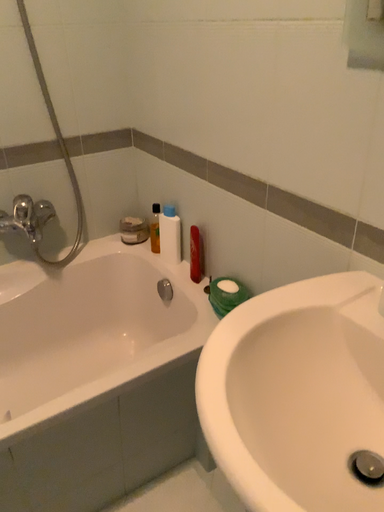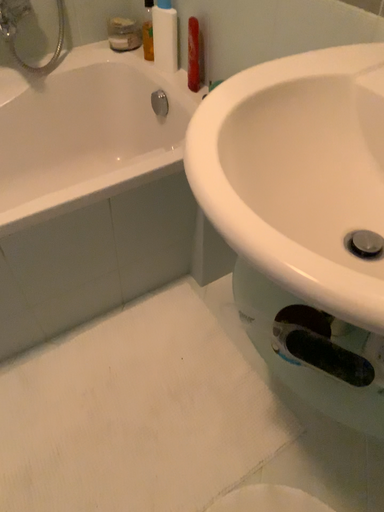
Question: How did the camera likely rotate when shooting the video?

Choices:
 (A) rotated downward
 (B) rotated upward

Answer: (A)